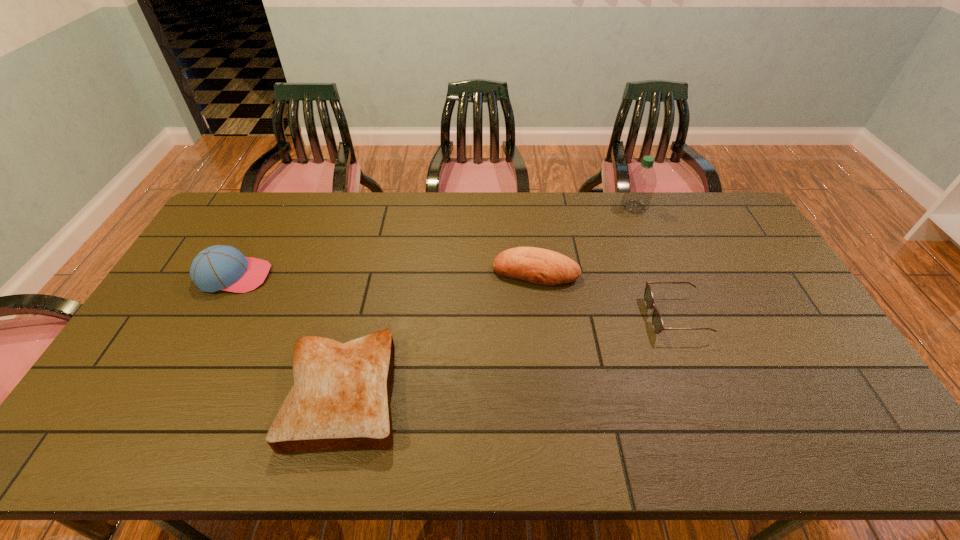
Where is `vacant space in between the tallest object and the spectacles`? The width and height of the screenshot is (960, 540). vacant space in between the tallest object and the spectacles is located at coordinates (655, 262).

In order to click on vacant area that lies between the spectacles and the baseball cap in this screenshot , I will do `click(455, 296)`.

You are a GUI agent. You are given a task and a screenshot of the screen. Output one action in this format:
    pyautogui.click(x=<x>, y=<y>)
    Task: Click on the vacant space that's between the farther bread and the spectacles
    This screenshot has width=960, height=540.
    Given the screenshot: What is the action you would take?
    pyautogui.click(x=605, y=294)

Where is `vacant space that's between the water bottle and the left bread`? This screenshot has height=540, width=960. vacant space that's between the water bottle and the left bread is located at coordinates point(490,300).

Locate an element on the screen. This screenshot has width=960, height=540. empty location between the water bottle and the spectacles is located at coordinates (655, 262).

Locate which object is the second closest to the baseball cap. Please provide its 2D coordinates. Your answer should be formatted as a tuple, i.e. [(x, y)], where the tuple contains the x and y coordinates of a point satisfying the conditions above.

[(539, 266)]

Locate an element on the screen. The height and width of the screenshot is (540, 960). the third closest object relative to the baseball cap is located at coordinates (657, 322).

The width and height of the screenshot is (960, 540). In order to click on free location that satisfies the following two spatial constraints: 1. on the front-facing side of the second object from left to right; 2. on the right side of the fourth shortest object in this screenshot , I will do click(172, 392).

Where is `free location that satisfies the following two spatial constraints: 1. on the front-facing side of the left bread; 2. on the left side of the baseball cap`? The height and width of the screenshot is (540, 960). free location that satisfies the following two spatial constraints: 1. on the front-facing side of the left bread; 2. on the left side of the baseball cap is located at coordinates (172, 392).